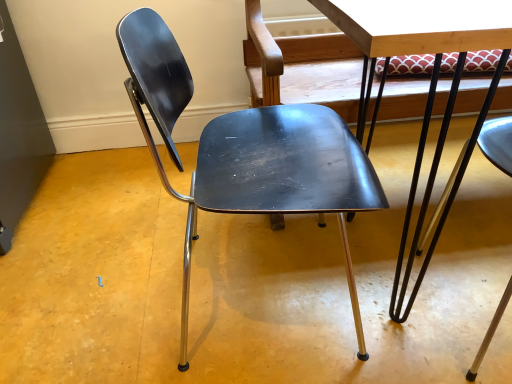
The height and width of the screenshot is (384, 512). I want to click on free point below metallic/smooth table at center (from a real-world perspective), so click(x=399, y=238).